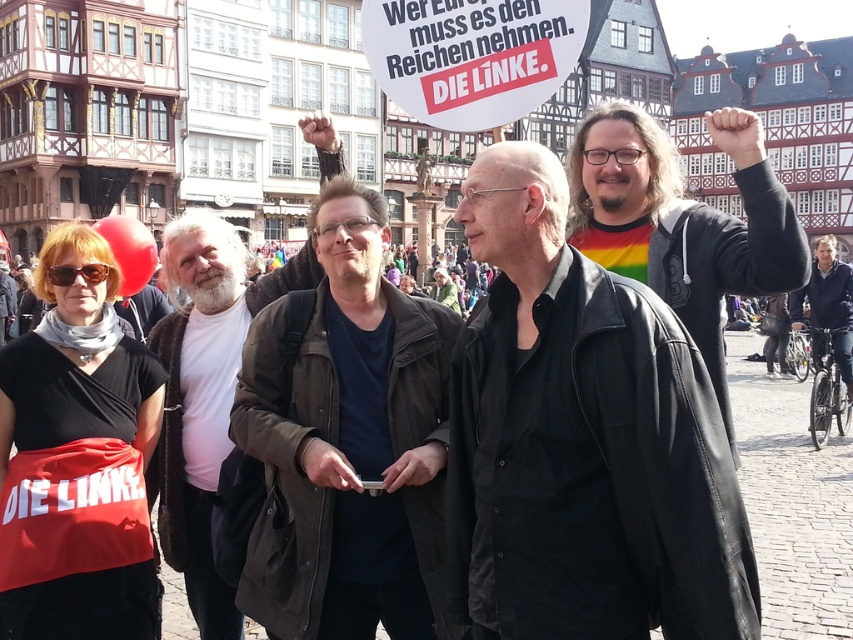
You are a photographer trying to capture a clear shot of both the black leather jacket at center and the dark brown leather jacket at center in the foreground of the protest scene. Given their sizes, which jacket should you focus on first to ensure it fits within your camera frame?

The black leather jacket at center has a larger size compared to the dark brown leather jacket at center, so you should focus on capturing the black leather jacket at center first to ensure it fits within the camera frame before adjusting for the smaller one.

What is the location of the point with coordinates (582,440) in the image?

The point with coordinates (582,440) is located on the black leather jacket at center.